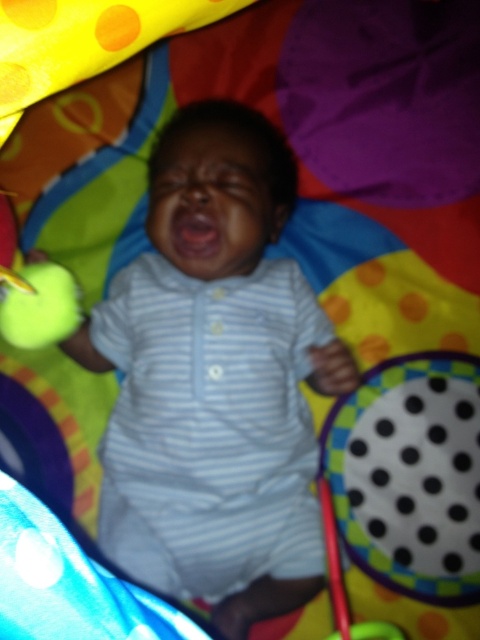
You are a parent trying to comfort your baby in the playpen. The baby is wearing a white striped onesie at center and there is a green rubber ball at left. Which item is closer to the baby?

The white striped onesie at center is closer to the baby because it is in front of the green rubber ball at left.

You are a parent trying to place a green rubber ball at left into the playpen. The white striped onesie at center is currently in the way. Can you fit the ball into the playpen without moving the onesie?

The white striped onesie at center has a greater height compared to the green rubber ball at left. Since the onesie is taller, it might block the path, making it difficult to fit the ball without moving the onesie.